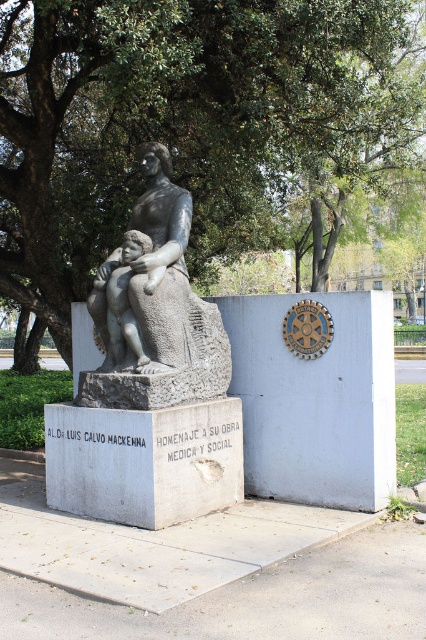
Question: Is matte gray stone statue at center to the right of matte gray statue at center from the viewer's perspective?

Choices:
 (A) yes
 (B) no

Answer: (A)

Question: Which of these objects is positioned farthest from the green leafy tree at upper center?

Choices:
 (A) matte gray statue at center
 (B) matte gray stone statue at center

Answer: (B)

Question: Which is nearer to the matte gray stone statue at center?

Choices:
 (A) matte gray statue at center
 (B) green leafy tree at upper center

Answer: (A)

Question: Does green leafy tree at upper center lie behind matte gray statue at center?

Choices:
 (A) no
 (B) yes

Answer: (B)

Question: Can you confirm if green leafy tree at upper center is bigger than matte gray stone statue at center?

Choices:
 (A) no
 (B) yes

Answer: (A)

Question: Which of the following is the farthest from the observer?

Choices:
 (A) green leafy tree at upper center
 (B) matte gray stone statue at center

Answer: (A)